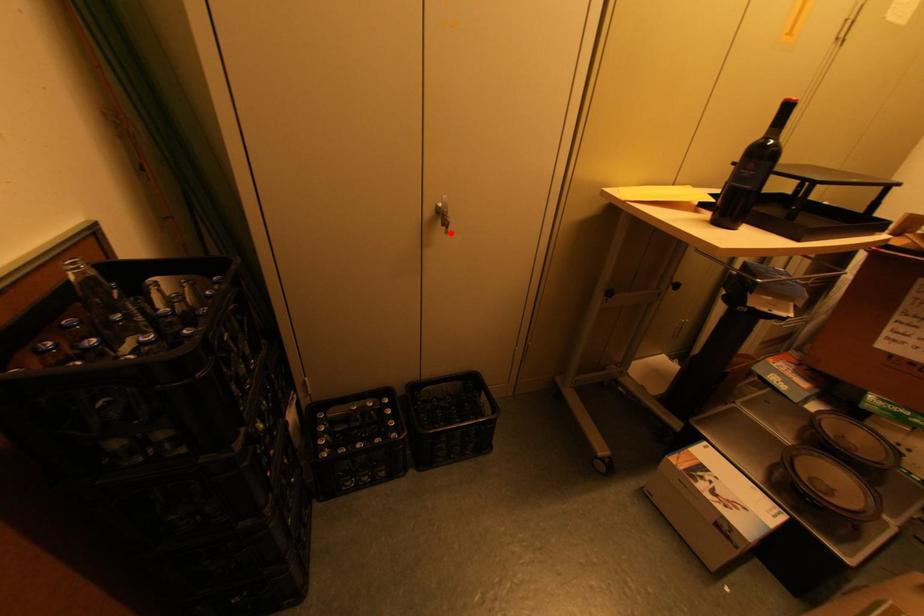
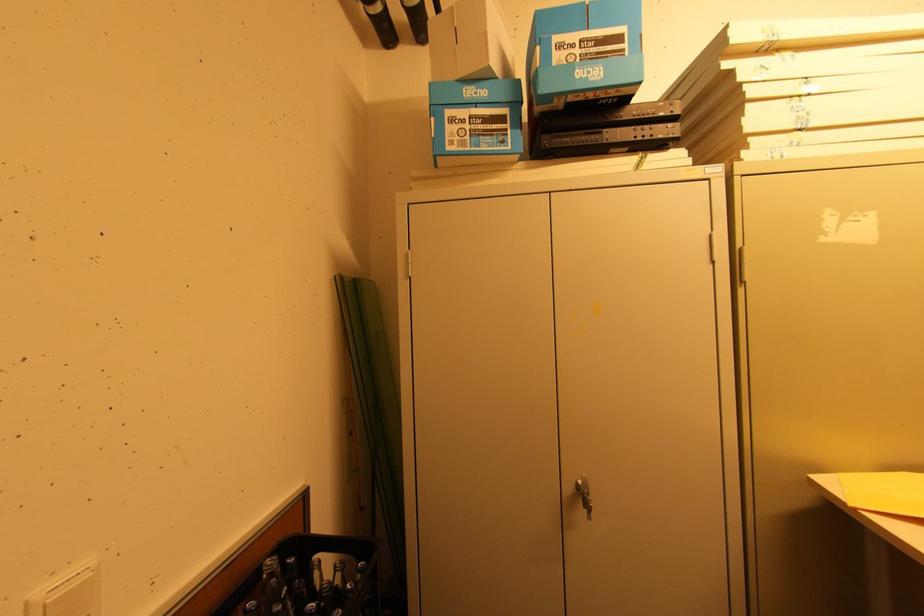
Find the pixel in the second image that matches the highlighted location in the first image.

(592, 519)